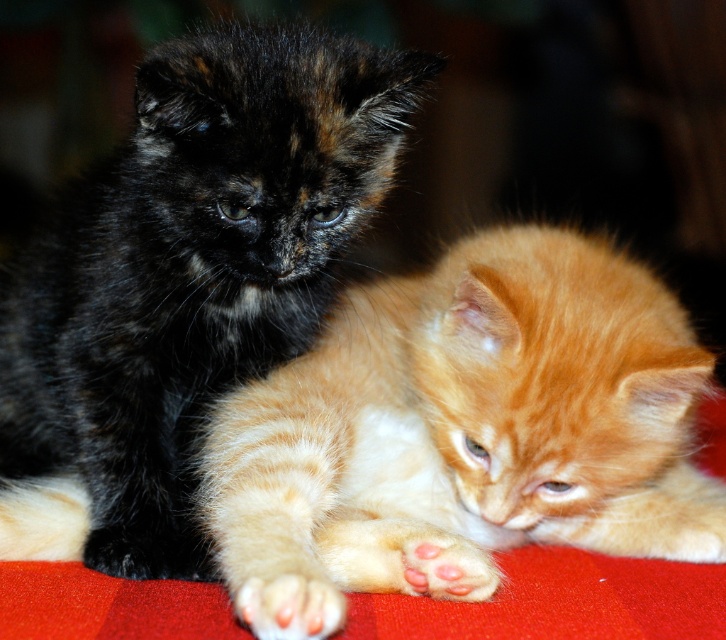
Question: Which object is closer to the camera taking this photo?

Choices:
 (A) black fur kitten at left
 (B) orange tabby kitten at center
 (C) white soft fur paw at lower left

Answer: (C)

Question: Does orange tabby kitten at center appear over black fur kitten at left?

Choices:
 (A) yes
 (B) no

Answer: (B)

Question: Does orange tabby kitten at center appear over white soft fur paw at lower left?

Choices:
 (A) yes
 (B) no

Answer: (A)

Question: Does orange tabby kitten at center appear over white soft fur paw at lower left?

Choices:
 (A) no
 (B) yes

Answer: (B)

Question: Which of the following is the closest to the observer?

Choices:
 (A) (240, 253)
 (B) (258, 589)
 (C) (635, 317)

Answer: (B)

Question: Which point is farther from the camera taking this photo?

Choices:
 (A) (652, 304)
 (B) (36, 236)

Answer: (B)